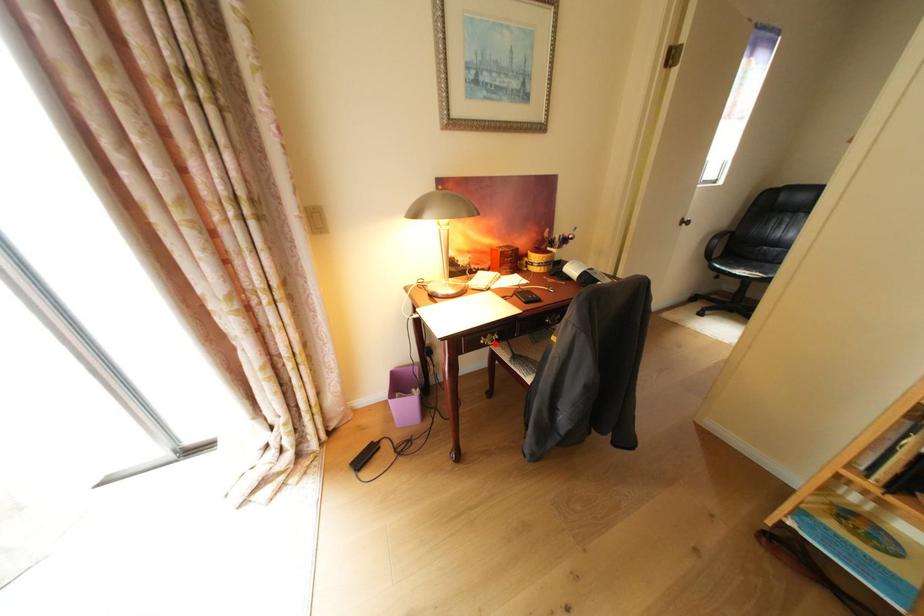
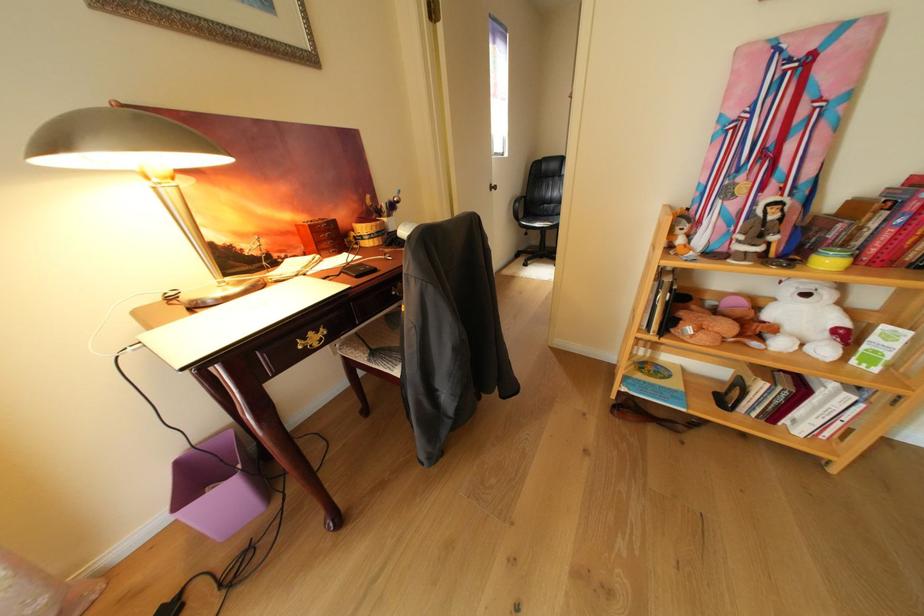
Locate, in the second image, the point that corresponds to the highlighted location in the first image.

(312, 349)